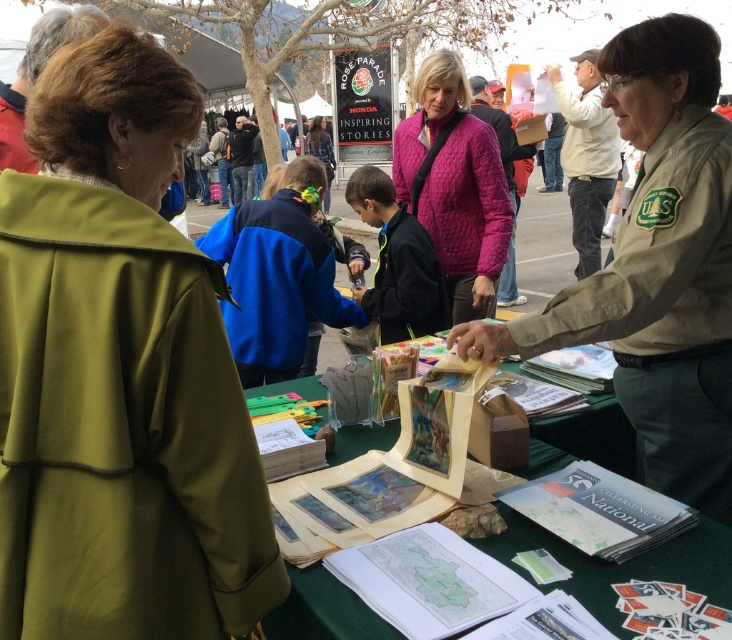
Question: Considering the real-world distances, which object is farthest from the blue fleece jacket at center?

Choices:
 (A) khaki uniform at center
 (B) matte paper bag at center

Answer: (B)

Question: Is pink quilted jacket at center to the right of black matte jacket at center from the viewer's perspective?

Choices:
 (A) no
 (B) yes

Answer: (B)

Question: Which point appears closest to the camera in this image?

Choices:
 (A) (530, 528)
 (B) (397, 280)
 (C) (336, 326)

Answer: (A)

Question: Is matte olive green coat at left thinner than matte paper bag at center?

Choices:
 (A) yes
 (B) no

Answer: (A)

Question: Estimate the real-world distances between objects in this image. Which object is farther from the khaki uniform at center?

Choices:
 (A) pink quilted jacket at center
 (B) blue fleece jacket at center
 (C) matte paper bag at center

Answer: (B)

Question: Can you confirm if matte paper bag at center is bigger than black matte jacket at center?

Choices:
 (A) yes
 (B) no

Answer: (A)